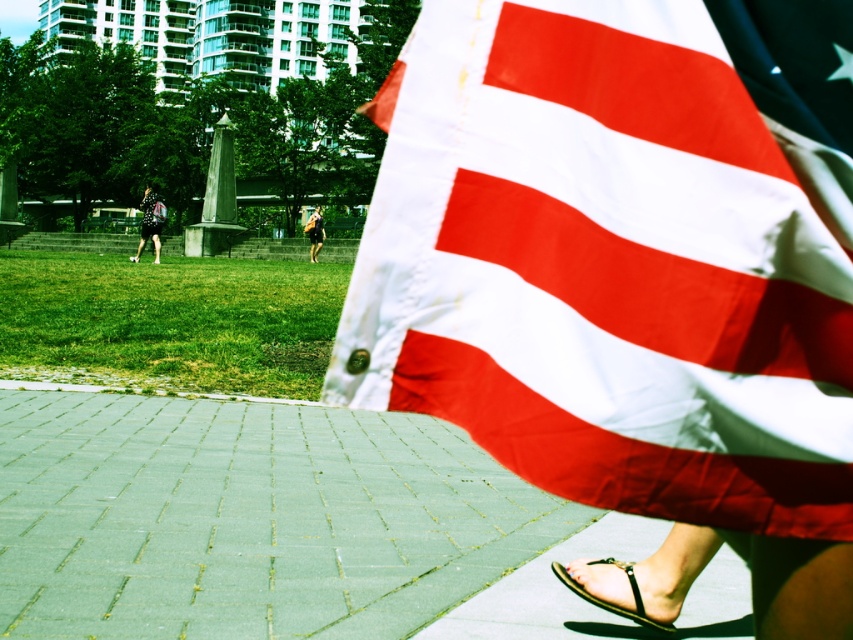
You are organizing a picnic and need to decide which item can fit into a small backpack. Based on the image, which object between the red and white striped fabric at right and the dark blue jeans at lower left is more likely to fit?

The red and white striped fabric at right has a smaller size compared to dark blue jeans at lower left, so it is more likely to fit into a small backpack.